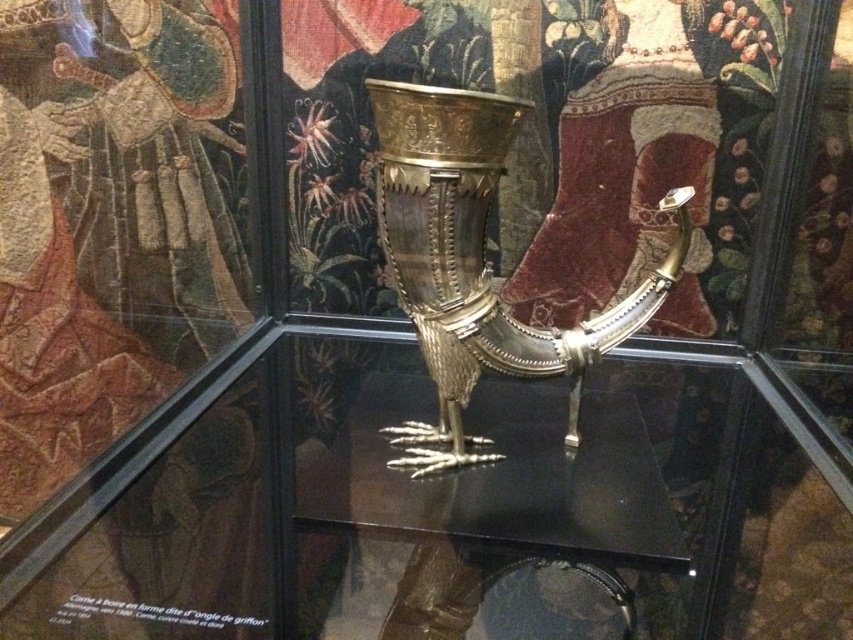
Which is more to the right, transparent glass table at center or gold metallic goblet at center?

gold metallic goblet at center is more to the right.

Does transparent glass table at center come behind gold metallic goblet at center?

No, it is not.

At what (x,y) coordinates should I click in order to perform the action: click on transparent glass table at center. Please return your answer as a coordinate pair (x, y). This screenshot has width=853, height=640. Looking at the image, I should click on (479, 515).